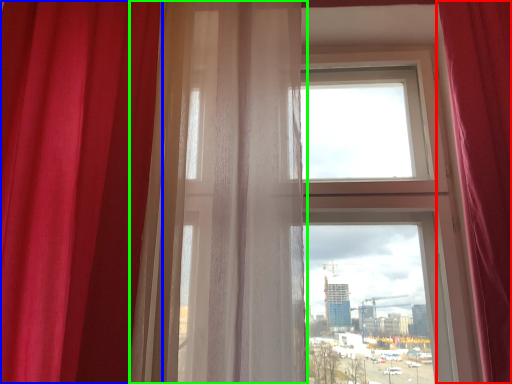
Question: Which object is positioned closest to curtain (highlighted by a red box)? Select from curtain (highlighted by a blue box) and curtain (highlighted by a green box).

Choices:
 (A) curtain
 (B) curtain

Answer: (B)